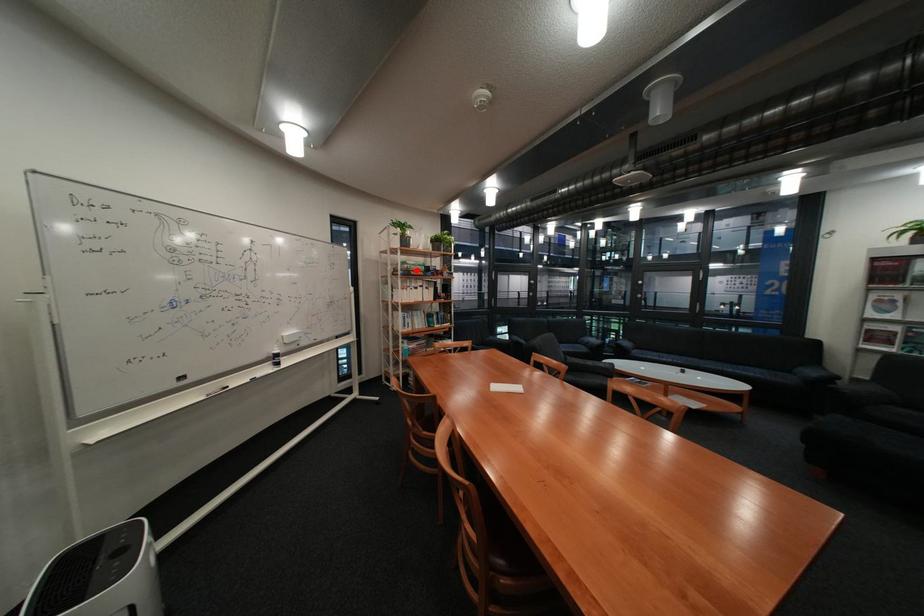
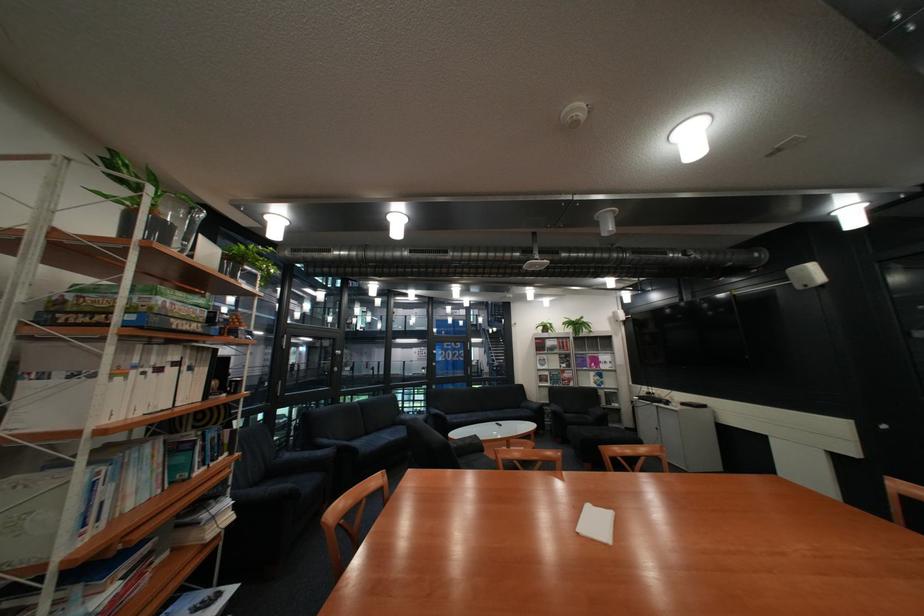
In the second image, find the point that corresponds to the highlighted location in the first image.

(141, 312)